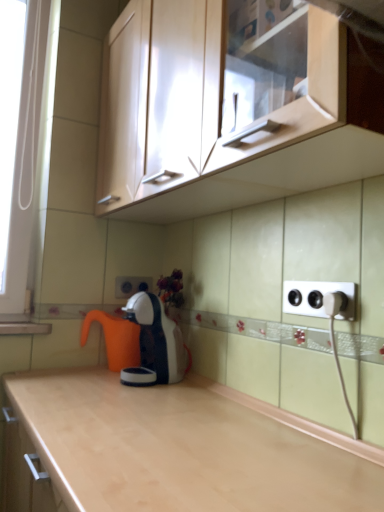
The width and height of the screenshot is (384, 512). What do you see at coordinates (158, 338) in the screenshot? I see `white glossy coffee machine at center` at bounding box center [158, 338].

The width and height of the screenshot is (384, 512). Identify the location of white plastic plug at right. (335, 303).

Where is `white plastic electrical outlet at right, placed as the first electric outlet when sorted from right to left`? white plastic electrical outlet at right, placed as the first electric outlet when sorted from right to left is located at coordinates (319, 298).

You are a GUI agent. You are given a task and a screenshot of the screen. Output one action in this format:
    pyautogui.click(x=<x>, y=<y>)
    Task: Click on the white glossy coffee machine at center
    This screenshot has height=512, width=384.
    Given the screenshot: What is the action you would take?
    pyautogui.click(x=158, y=338)

Which object is wider, orange plastic coffee pot at center or white plastic plug at right?

orange plastic coffee pot at center is wider.

From a real-world perspective, which is physically below, orange plastic coffee pot at center or white plastic plug at right?

From a 3D spatial view, orange plastic coffee pot at center is below.

Is orange plastic coffee pot at center with white plastic plug at right?

No, orange plastic coffee pot at center is not with white plastic plug at right.

Which is further, (334,302) or (146,355)?

The point (146,355) is behind.

Would you say white plastic plug at right is a long distance from white glossy coffee machine at center?

That's not correct — white plastic plug at right is a little close to white glossy coffee machine at center.

From the image's perspective, does white plastic plug at right appear lower than white glossy coffee machine at center?

No, from the image's perspective, white plastic plug at right is not beneath white glossy coffee machine at center.

Based on the photo, is white plastic plug at right thinner than white glossy coffee machine at center?

Yes.

From a real-world perspective, is white glossy coffee machine at center located beneath white plastic electrical outlet at right, the 2th electric outlet from the left?

Correct, in the physical world, white glossy coffee machine at center is lower than white plastic electrical outlet at right, the 2th electric outlet from the left.

Can you confirm if white glossy coffee machine at center is taller than white plastic electrical outlet at right, arranged as the 2th electric outlet when viewed from the back?

Yes.

Looking at this image, is white glossy coffee machine at center next to white plastic electrical outlet at right, arranged as the 2th electric outlet when viewed from the back, and touching it?

No, white glossy coffee machine at center is not with white plastic electrical outlet at right, arranged as the 2th electric outlet when viewed from the back.

Based on the photo, from the image's perspective, between matte wood cabinet at upper center and white plastic electrical outlet at right, the 2th electric outlet from the left, who is located below?

white plastic electrical outlet at right, the 2th electric outlet from the left.

From a real-world perspective, who is located lower, matte wood cabinet at upper center or white plastic electrical outlet at right, arranged as the 2th electric outlet when viewed from the back?

white plastic electrical outlet at right, arranged as the 2th electric outlet when viewed from the back.

In terms of size, does matte wood cabinet at upper center appear bigger or smaller than white plastic electrical outlet at right, the 2th electric outlet from the left?

In the image, matte wood cabinet at upper center appears to be larger than white plastic electrical outlet at right, the 2th electric outlet from the left.

Considering the relative positions of matte wood cabinet at upper center and white plastic electrical outlet at right, the 2th electric outlet from the left, in the image provided, is matte wood cabinet at upper center to the right of white plastic electrical outlet at right, the 2th electric outlet from the left, from the viewer's perspective?

In fact, matte wood cabinet at upper center is to the left of white plastic electrical outlet at right, the 2th electric outlet from the left.

Is white plastic electric outlet at center, which ranks as the 2th electric outlet in right-to-left order, surrounded by matte wood cabinet at upper center?

Actually, white plastic electric outlet at center, which ranks as the 2th electric outlet in right-to-left order, is outside matte wood cabinet at upper center.

Is matte wood cabinet at upper center at the right side of white plastic electric outlet at center, which ranks as the first electric outlet in left-to-right order?

Indeed, matte wood cabinet at upper center is positioned on the right side of white plastic electric outlet at center, which ranks as the first electric outlet in left-to-right order.

Which is less distant, (124,178) or (127,290)?

Point (124,178) is positioned closer to the camera compared to point (127,290).

Is white plastic plug at right in front of or behind white plastic electrical outlet at right, the 2th electric outlet from the left, in the image?

Clearly, white plastic plug at right is behind white plastic electrical outlet at right, the 2th electric outlet from the left.

Looking at this image, could white plastic electrical outlet at right, placed as the first electric outlet when sorted from right to left, be considered to be inside white plastic plug at right?

No, white plastic electrical outlet at right, placed as the first electric outlet when sorted from right to left, is not inside white plastic plug at right.

From the image's perspective, would you say white plastic plug at right is positioned over white plastic electrical outlet at right, the 1th electric outlet in the front-to-back sequence?

Actually, white plastic plug at right appears below white plastic electrical outlet at right, the 1th electric outlet in the front-to-back sequence, in the image.

Which of these two, white plastic plug at right or white plastic electrical outlet at right, the 1th electric outlet in the front-to-back sequence, stands taller?

white plastic electrical outlet at right, the 1th electric outlet in the front-to-back sequence.

Which is more to the left, matte wood cabinet at upper center or white plastic plug at right?

From the viewer's perspective, matte wood cabinet at upper center appears more on the left side.

Which object is further away from the camera, matte wood cabinet at upper center or white plastic plug at right?

white plastic plug at right is more distant.

Based on the photo, from the image's perspective, which object appears higher, matte wood cabinet at upper center or white plastic plug at right?

From the image's view, matte wood cabinet at upper center is above.

How distant is matte wood cabinet at upper center from white plastic plug at right?

matte wood cabinet at upper center and white plastic plug at right are 23.39 inches apart from each other.

Identify the location of coffeepot below the white plastic plug at right (from the image's perspective). (115, 339).

Find the location of a particular element. The width and height of the screenshot is (384, 512). knob that is above the white glossy coffee machine at center (from a real-world perspective) is located at coordinates (335, 303).

From the picture: Looking at the image, which one is located closer to orange plastic coffee pot at center, white plastic electric outlet at center, which ranks as the 2th electric outlet in right-to-left order, or white plastic plug at right?

The object closer to orange plastic coffee pot at center is white plastic electric outlet at center, which ranks as the 2th electric outlet in right-to-left order.

Estimate the real-world distances between objects in this image. Which object is further from white plastic electrical outlet at right, the 2th electric outlet from the left, white glossy coffee machine at center or matte wood cabinet at upper center?

Among the two, white glossy coffee machine at center is located further to white plastic electrical outlet at right, the 2th electric outlet from the left.

In the scene shown: From the image, which object appears to be farther from white plastic electric outlet at center, which ranks as the 2th electric outlet in right-to-left order, white plastic electrical outlet at right, arranged as the 2th electric outlet when viewed from the back, or matte wood cabinet at upper center?

Among the two, matte wood cabinet at upper center is located further to white plastic electric outlet at center, which ranks as the 2th electric outlet in right-to-left order.

Based on the photo, based on their spatial positions, is white plastic electrical outlet at right, the 2th electric outlet from the left, or white plastic plug at right closer to white glossy coffee machine at center?

white plastic electrical outlet at right, the 2th electric outlet from the left.

Looking at this image, which object lies further to the anchor point orange plastic coffee pot at center, white plastic plug at right or matte wood cabinet at upper center?

white plastic plug at right is further to orange plastic coffee pot at center.

Considering their positions, is orange plastic coffee pot at center positioned closer to white glossy coffee machine at center than white plastic electrical outlet at right, the 1th electric outlet in the front-to-back sequence?

orange plastic coffee pot at center is positioned closer to the anchor white glossy coffee machine at center.

From the image, which object appears to be nearer to orange plastic coffee pot at center, white plastic electrical outlet at right, placed as the first electric outlet when sorted from right to left, or white glossy coffee machine at center?

white glossy coffee machine at center lies closer to orange plastic coffee pot at center than the other object.

Considering their positions, is white plastic electrical outlet at right, arranged as the 2th electric outlet when viewed from the back, positioned closer to white glossy coffee machine at center than orange plastic coffee pot at center?

Among the two, orange plastic coffee pot at center is located nearer to white glossy coffee machine at center.

What are the coordinates of `electric outlet between matte wood cabinet at upper center and white plastic electric outlet at center, the 1th electric outlet when ordered from back to front, along the z-axis` in the screenshot? It's located at (319, 298).

Find the location of a particular element. home appliance between white plastic electrical outlet at right, arranged as the 2th electric outlet when viewed from the back, and white plastic electric outlet at center, the 1th electric outlet when ordered from back to front, from front to back is located at coordinates (158, 338).

The width and height of the screenshot is (384, 512). I want to click on knob positioned between white plastic electrical outlet at right, placed as the first electric outlet when sorted from right to left, and orange plastic coffee pot at center from near to far, so click(x=335, y=303).

Image resolution: width=384 pixels, height=512 pixels. I want to click on electric outlet between matte wood cabinet at upper center and orange plastic coffee pot at center along the z-axis, so (319, 298).